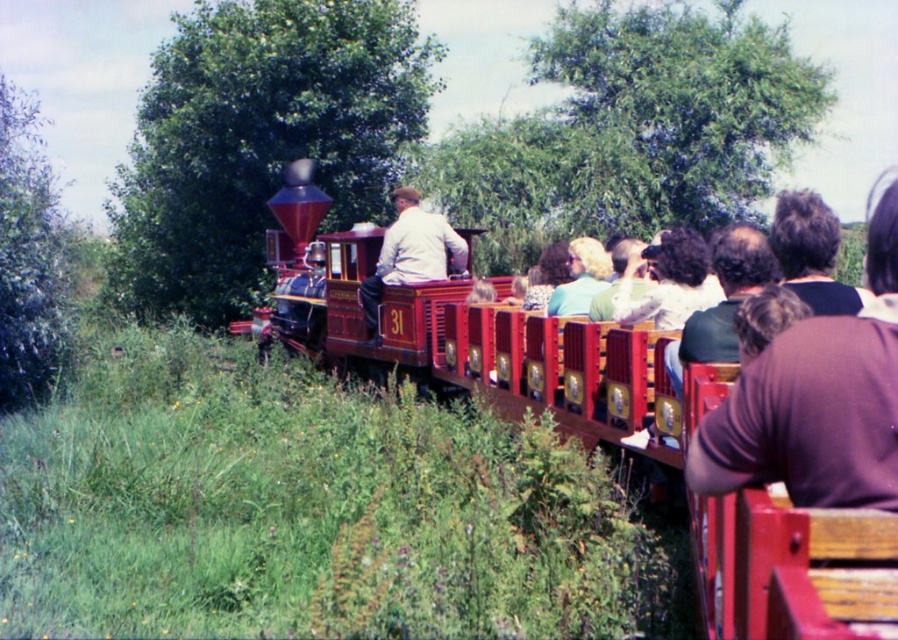
Who is more distant from viewer, (x=492, y=372) or (x=832, y=280)?

The point (x=492, y=372) is behind.

Where is `polished wood train at center`? This screenshot has width=898, height=640. polished wood train at center is located at coordinates (477, 339).

Identify the location of polished wood train at center. (477, 339).

Is polished wood train at center below matte white shirt at center?

Yes.

Can you confirm if polished wood train at center is bigger than matte white shirt at center?

Correct, polished wood train at center is larger in size than matte white shirt at center.

I want to click on polished wood train at center, so click(x=477, y=339).

Does brown fabric shirt at right appear over dark brown hair at upper right?

No.

Can you confirm if brown fabric shirt at right is positioned to the right of dark brown hair at upper right?

Incorrect, brown fabric shirt at right is not on the right side of dark brown hair at upper right.

Identify the location of brown fabric shirt at right. (816, 401).